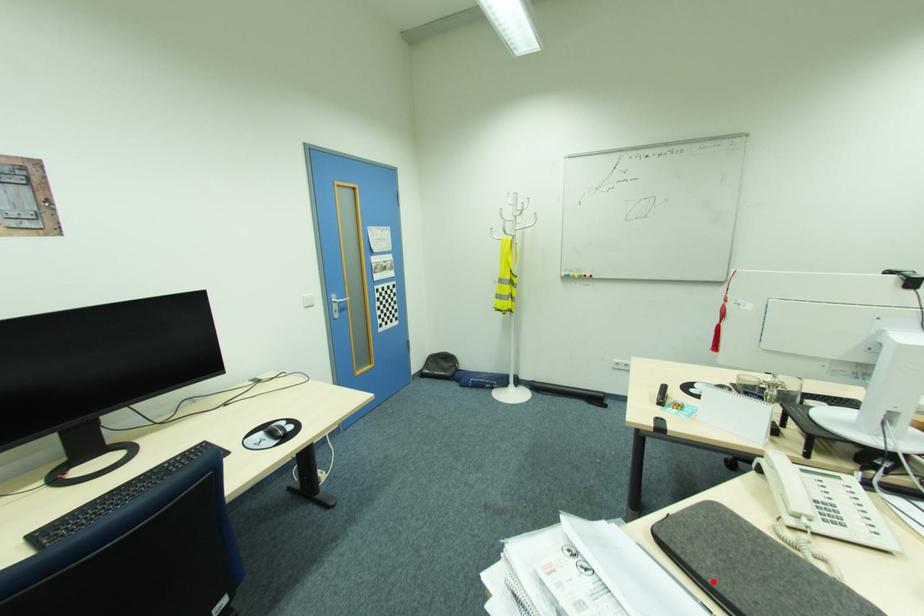
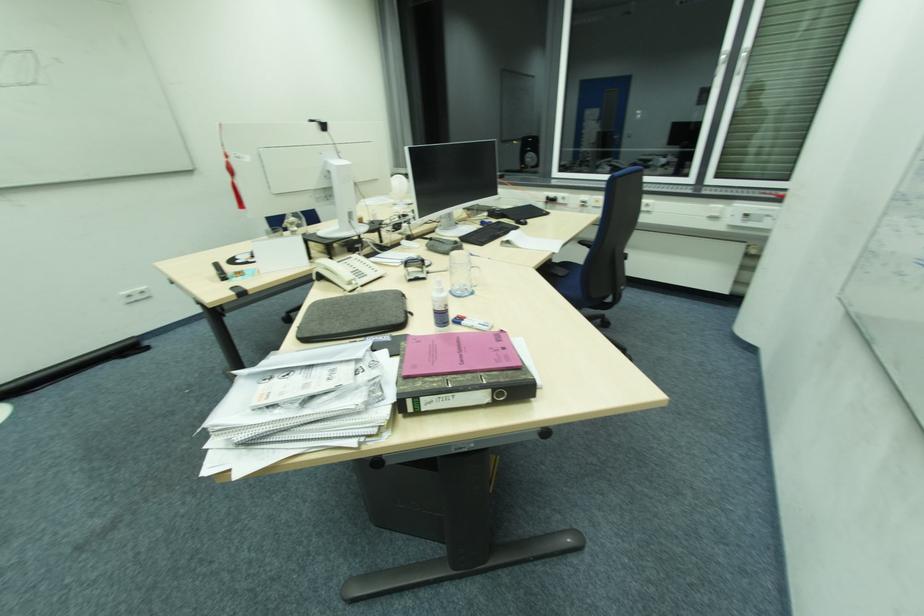
Locate, in the second image, the point that corresponds to the highlighted location in the first image.

(348, 331)